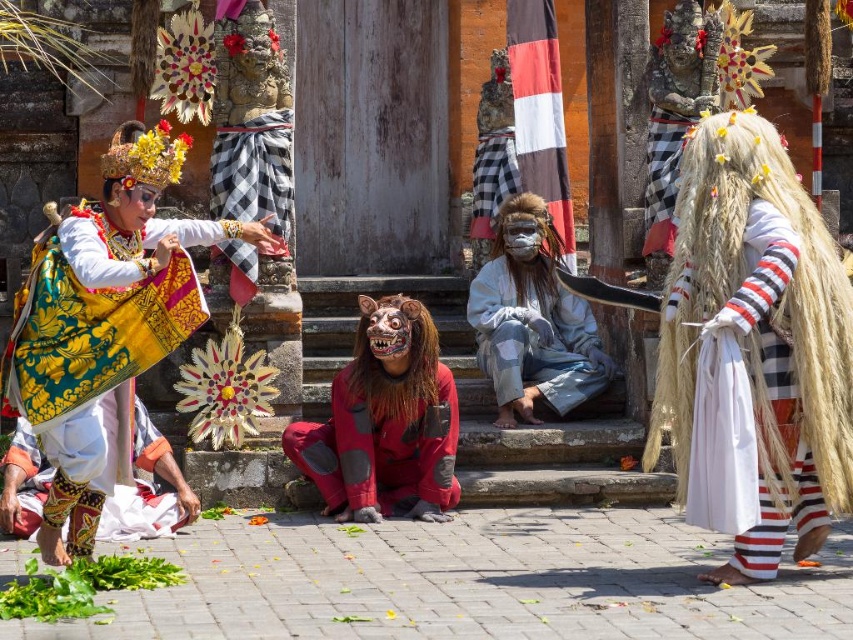
Is red matte mask at center wider than camouflage fabric mask at center?

No.

Who is more forward, (334,483) or (576,360)?

Point (334,483) is in front.

What are the coordinates of `red matte mask at center` in the screenshot? It's located at (379, 451).

Does white woven fabric at right have a larger size compared to textured batik skirt at lower left?

Yes.

Does white woven fabric at right have a greater width compared to textured batik skirt at lower left?

Incorrect, white woven fabric at right's width does not surpass textured batik skirt at lower left's.

Is point (830, 284) behind point (7, 508)?

No, (830, 284) is in front of (7, 508).

Where is `white woven fabric at right`? The height and width of the screenshot is (640, 853). white woven fabric at right is located at coordinates (779, 396).

What do you see at coordinates (534, 339) in the screenshot? I see `camouflage fabric mask at center` at bounding box center [534, 339].

Does camouflage fabric mask at center appear over textured batik skirt at lower left?

Indeed, camouflage fabric mask at center is positioned over textured batik skirt at lower left.

Does point (532, 381) come farther from viewer compared to point (144, 509)?

That is True.

Image resolution: width=853 pixels, height=640 pixels. Identify the location of camouflage fabric mask at center. (534, 339).